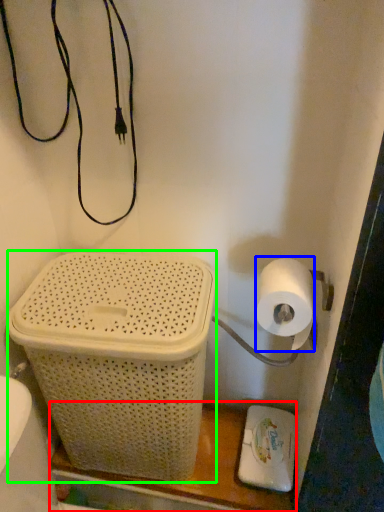
Question: Which is farther away from shelf (highlighted by a red box)? toilet paper (highlighted by a blue box) or basket container (highlighted by a green box)?

Choices:
 (A) toilet paper
 (B) basket container

Answer: (A)